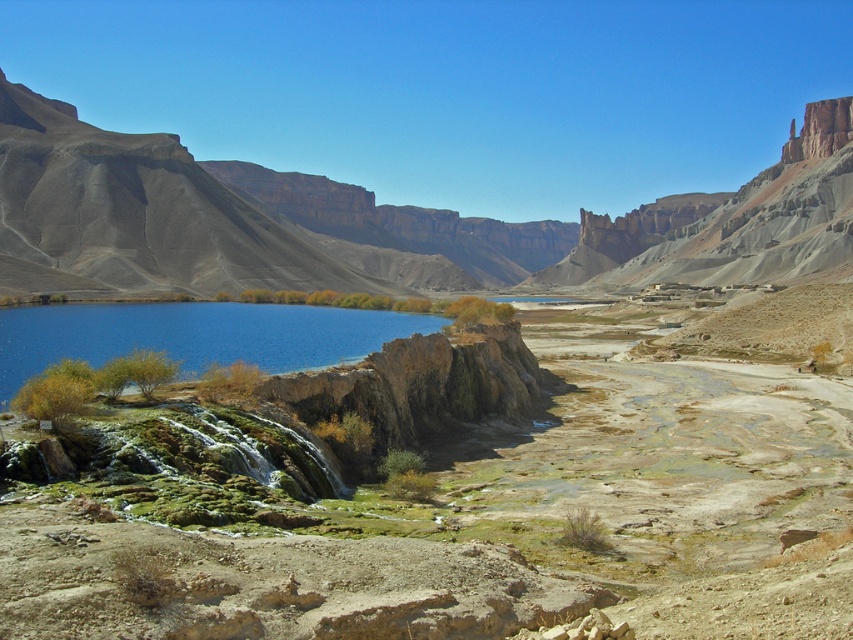
You are a hiker planning to cross the blue water at center to reach the rustic brown cliff at left. Based on the scene, which part of the terrain is wider and would provide a more stable path?

The rustic brown cliff at left is wider than the blue water at center, so it would provide a more stable path for crossing.

You are planning to build a small cabin near the rustic brown cliff at left and the blue water at center. Considering their sizes, which location would provide more space for your cabin?

The rustic brown cliff at left is bigger than the blue water at center, so building the cabin near the rustic brown cliff at left would provide more space for your cabin.

You are standing on the rustic brown cliff at left and want to see the blue water at center. Which direction should you look to see it?

The blue water at center is behind the rustic brown cliff at left, so you should look behind the cliff to see it.